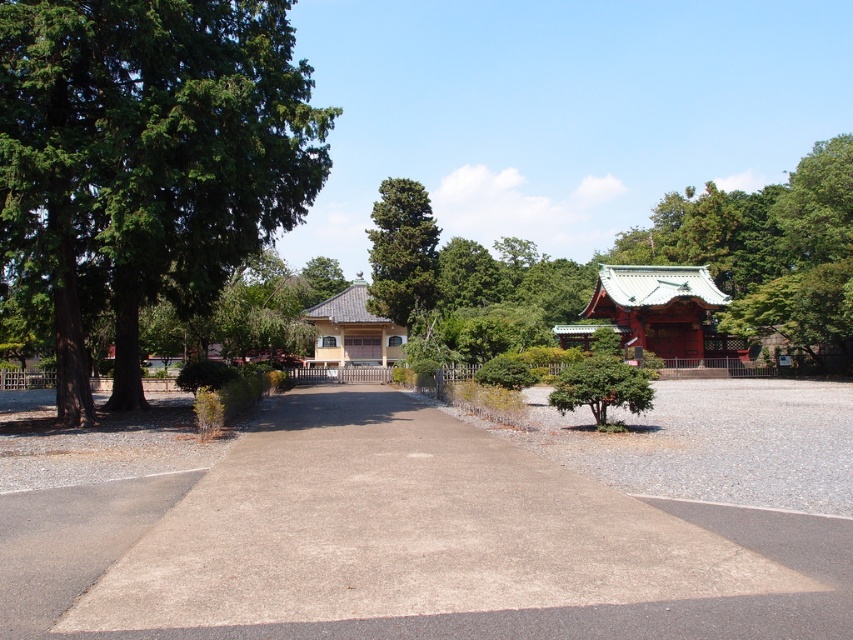
Which is below, gray concrete driveway at center or green textured tree at center?

gray concrete driveway at center is lower down.

Between point (173, 630) and point (386, 280), which one is positioned in front?

Positioned in front is point (173, 630).

Image resolution: width=853 pixels, height=640 pixels. I want to click on gray concrete driveway at center, so click(x=405, y=544).

Is gray concrete driveway at center wider than green leafy tree at left?

No, gray concrete driveway at center is not wider than green leafy tree at left.

Between point (358, 572) and point (215, 58), which one is positioned behind?

Positioned behind is point (215, 58).

Which is behind, point (178, 502) or point (114, 289)?

The point (114, 289) is more distant.

Locate an element on the screen. gray concrete driveway at center is located at coordinates (405, 544).

Between green leafy tree at left and green textured tree at center, which one is positioned lower?

green leafy tree at left is below.

Which of these two, green leafy tree at left or green textured tree at center, stands shorter?

green textured tree at center

Where is `green leafy tree at left`? The width and height of the screenshot is (853, 640). green leafy tree at left is located at coordinates (146, 157).

You are a GUI agent. You are given a task and a screenshot of the screen. Output one action in this format:
    pyautogui.click(x=<x>, y=<y>)
    Task: Click on the green leafy tree at left
    This screenshot has width=853, height=640.
    Given the screenshot: What is the action you would take?
    pyautogui.click(x=146, y=157)